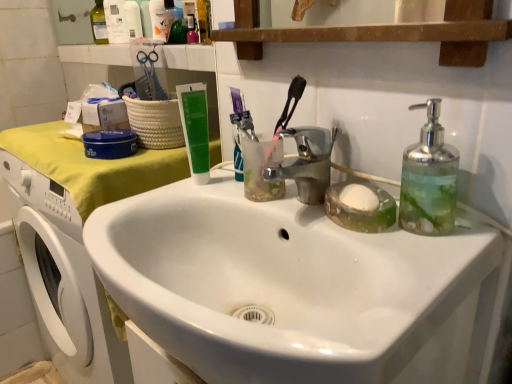
At what (x,y) coordinates should I click in order to perform the action: click on free space in front of clear glass soap dispenser at right. Please return your answer as a coordinate pair (x, y). The height and width of the screenshot is (384, 512). Looking at the image, I should click on (421, 275).